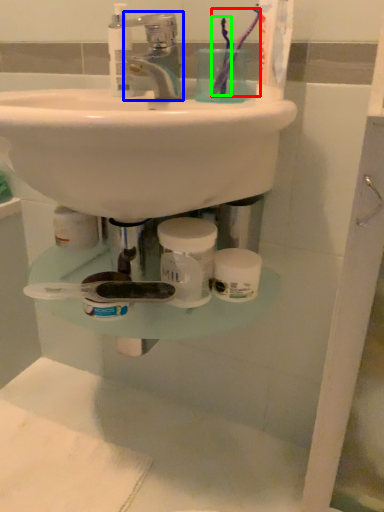
Question: Which is farther away from toothbrush (highlighted by a red box)? tap (highlighted by a blue box) or toothbrush (highlighted by a green box)?

Choices:
 (A) tap
 (B) toothbrush

Answer: (A)